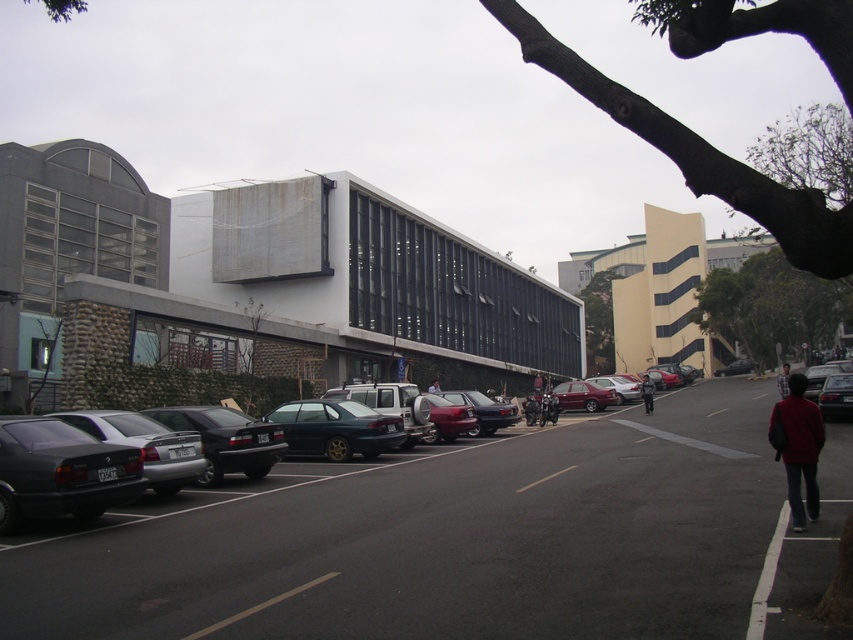
Question: Can you confirm if shiny red sedan at center is smaller than dark brown leather jacket at center?

Choices:
 (A) no
 (B) yes

Answer: (B)

Question: Which point is closer to the camera taking this photo?

Choices:
 (A) (556, 472)
 (B) (428, 387)
 (C) (805, 403)

Answer: (C)

Question: Estimate the real-world distances between objects in this image. Which object is closer to the blue denim jeans at lower right?

Choices:
 (A) matte black car at left
 (B) shiny silver sedan at center-left
 (C) white painted line at lower right

Answer: (A)

Question: From the image, what is the correct spatial relationship of silver metallic sedan at center-left in relation to white fabric shirt at center?

Choices:
 (A) below
 (B) above

Answer: (B)

Question: Estimate the real-world distances between objects in this image. Which object is closer to the matte black car at left?

Choices:
 (A) white painted line at lower right
 (B) dark brown leather jacket at center
 (C) dark red sweater at lower right
 (D) white fabric shirt at center

Answer: (A)

Question: Is blue denim jeans at lower right below white fabric shirt at center?

Choices:
 (A) yes
 (B) no

Answer: (B)